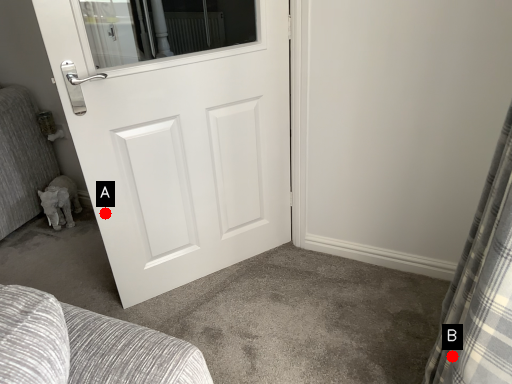
Question: Two points are circled on the image, labeled by A and B beside each circle. Which point is closer to the camera?

Choices:
 (A) A is closer
 (B) B is closer

Answer: (B)